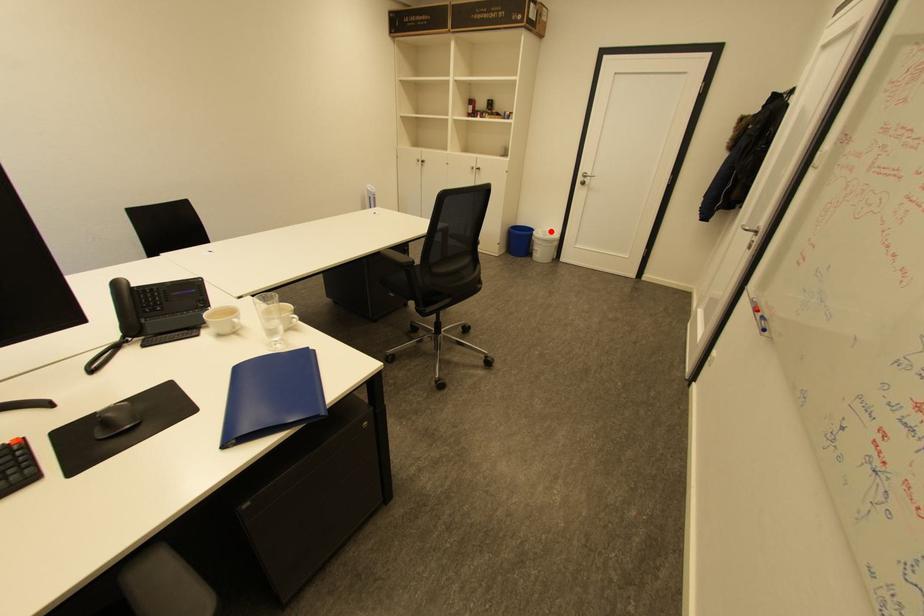
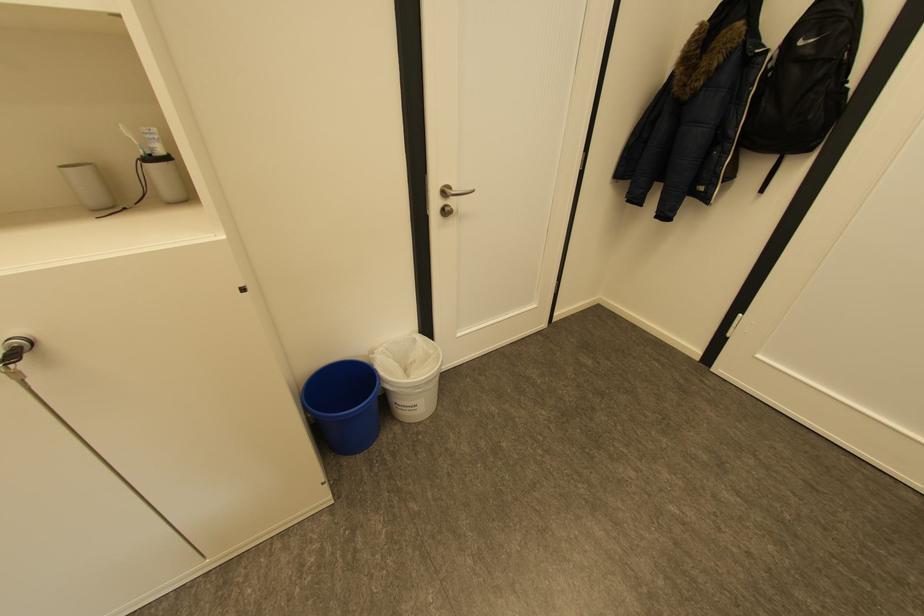
Find the pixel in the second image that matches the highlighted location in the first image.

(394, 349)